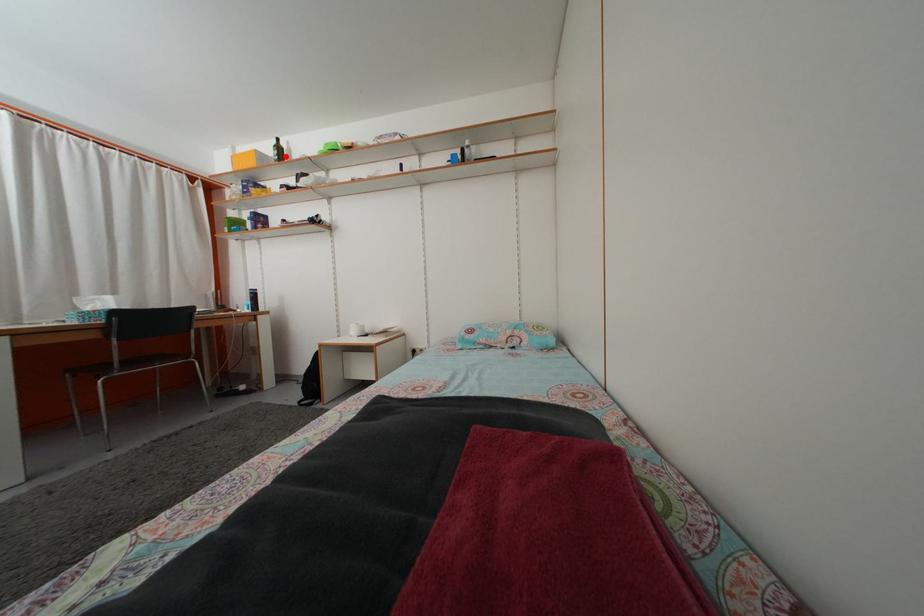
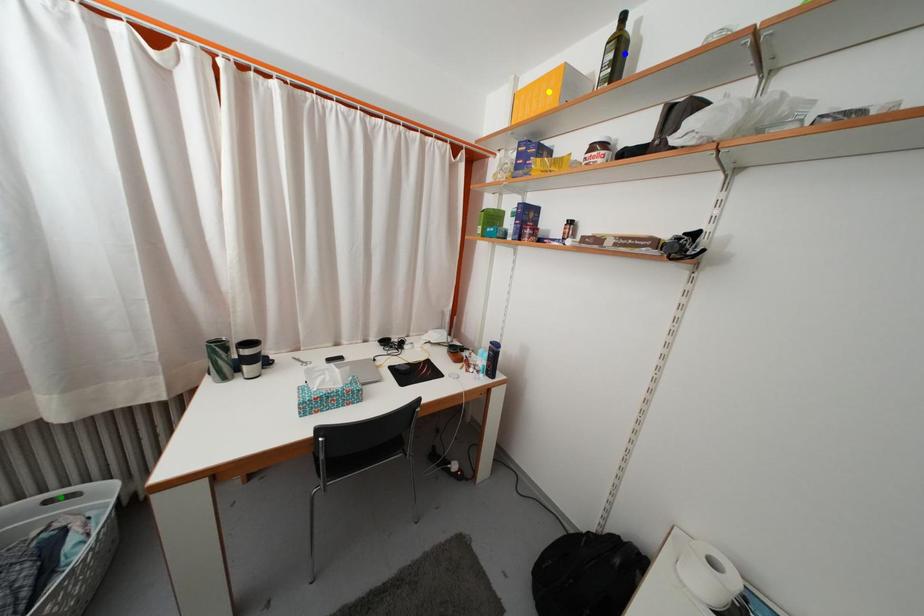
Question: I am providing you with two images of the same scene from different viewpoints. A red point is marked on the first image. You are given multiple points on the second image. Which spot in image 2 lines up with the point in image 1?

Choices:
 (A) blue point
 (B) yellow point
 (C) green point

Answer: (A)